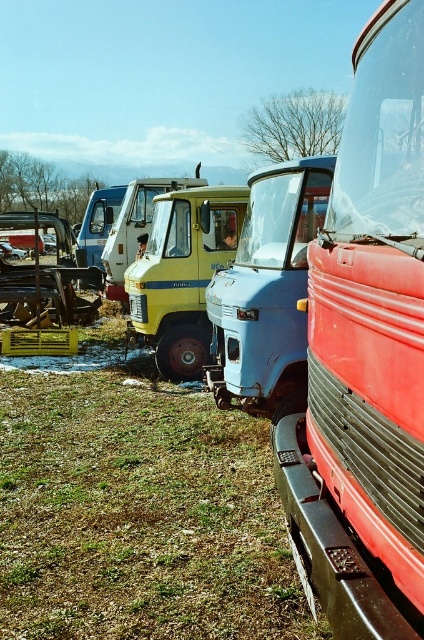
Does green grass at lower left have a smaller size compared to metallic silver car at center?

Indeed, green grass at lower left has a smaller size compared to metallic silver car at center.

From the picture: Who is lower down, green grass at lower left or metallic silver car at center?

green grass at lower left is below.

Find the location of a particular element. This screenshot has width=424, height=640. green grass at lower left is located at coordinates (139, 516).

Identify the location of green grass at lower left. (139, 516).

Does point (404, 268) come in front of point (36, 314)?

Yes, point (404, 268) is closer to viewer.

Is point (409, 632) positioned behind point (53, 268)?

No, (409, 632) is in front of (53, 268).

Where is `matte blue truck at center`? This screenshot has width=424, height=640. matte blue truck at center is located at coordinates (365, 355).

Between green grass at lower left and wooden frame at left, which one appears on the left side from the viewer's perspective?

Positioned to the left is wooden frame at left.

The height and width of the screenshot is (640, 424). What are the coordinates of `green grass at lower left` in the screenshot? It's located at (139, 516).